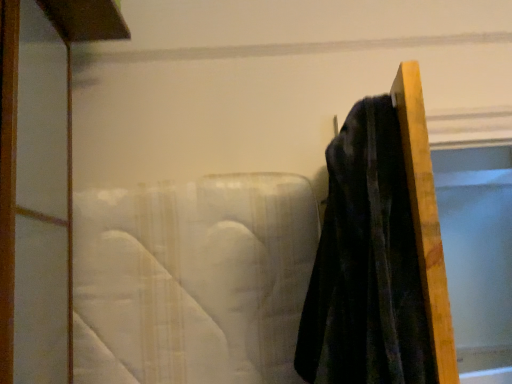
At what (x,y) coordinates should I click in order to perform the action: click on white textured bathrobe at left. Please return your answer as a coordinate pair (x, y). The height and width of the screenshot is (384, 512). Looking at the image, I should click on (196, 277).

What do you see at coordinates (196, 277) in the screenshot? Image resolution: width=512 pixels, height=384 pixels. I see `white textured bathrobe at left` at bounding box center [196, 277].

What is the approximate width of white textured bathrobe at left?

white textured bathrobe at left is 4.66 inches in width.

The width and height of the screenshot is (512, 384). I want to click on white textured bathrobe at left, so click(x=196, y=277).